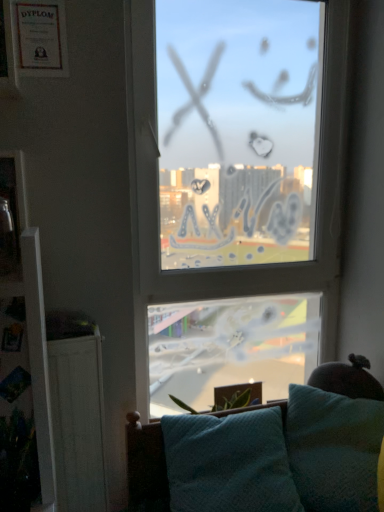
Question: Does transparent glass window at center have a greater height compared to metallic glass picture frame at left, which appears as the second picture frame when viewed from the top?

Choices:
 (A) yes
 (B) no

Answer: (A)

Question: Is transparent glass window at center far away from metallic glass picture frame at left, which is counted as the 1th picture frame, starting from the bottom?

Choices:
 (A) yes
 (B) no

Answer: (B)

Question: Is transparent glass window at center to the left of metallic glass picture frame at left, which is counted as the 1th picture frame, starting from the bottom, from the viewer's perspective?

Choices:
 (A) yes
 (B) no

Answer: (B)

Question: Could metallic glass picture frame at left, the first picture frame positioned from the front, be considered to be inside transparent glass window at center?

Choices:
 (A) no
 (B) yes

Answer: (A)

Question: From the image's perspective, is transparent glass window at center located above metallic glass picture frame at left, which appears as the second picture frame when viewed from the top?

Choices:
 (A) yes
 (B) no

Answer: (A)

Question: From the image's perspective, does transparent glass window at center appear lower than metallic glass picture frame at left, acting as the 2th picture frame starting from the back?

Choices:
 (A) yes
 (B) no

Answer: (B)

Question: Is teal fabric studio couch at lower center to the left of transparent glass window at center from the viewer's perspective?

Choices:
 (A) no
 (B) yes

Answer: (B)

Question: Is teal fabric studio couch at lower center positioned with its back to transparent glass window at center?

Choices:
 (A) yes
 (B) no

Answer: (A)

Question: Is teal fabric studio couch at lower center in front of transparent glass window at center?

Choices:
 (A) no
 (B) yes

Answer: (B)

Question: From a real-world perspective, is teal fabric studio couch at lower center on top of transparent glass window at center?

Choices:
 (A) yes
 (B) no

Answer: (B)

Question: From the image's perspective, is teal fabric studio couch at lower center located beneath transparent glass window at center?

Choices:
 (A) no
 (B) yes

Answer: (B)

Question: Does teal fabric studio couch at lower center appear on the right side of transparent glass window at center?

Choices:
 (A) no
 (B) yes

Answer: (A)

Question: Could you tell me if matte paper frame at upper left, positioned as the first picture frame in top-to-bottom order, is turned towards transparent glass window at center?

Choices:
 (A) no
 (B) yes

Answer: (A)